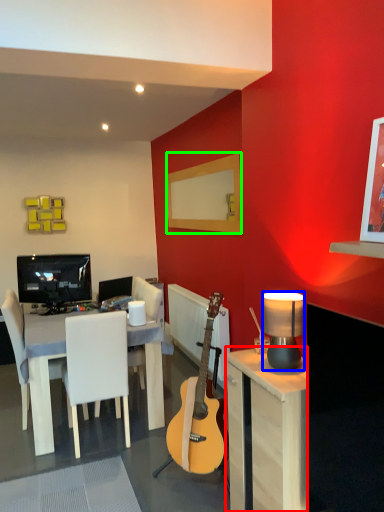
Question: Based on their relative distances, which object is farther from desk (highlighted by a red box)? Choose from lamp (highlighted by a blue box) and mirror (highlighted by a green box).

Choices:
 (A) lamp
 (B) mirror

Answer: (B)